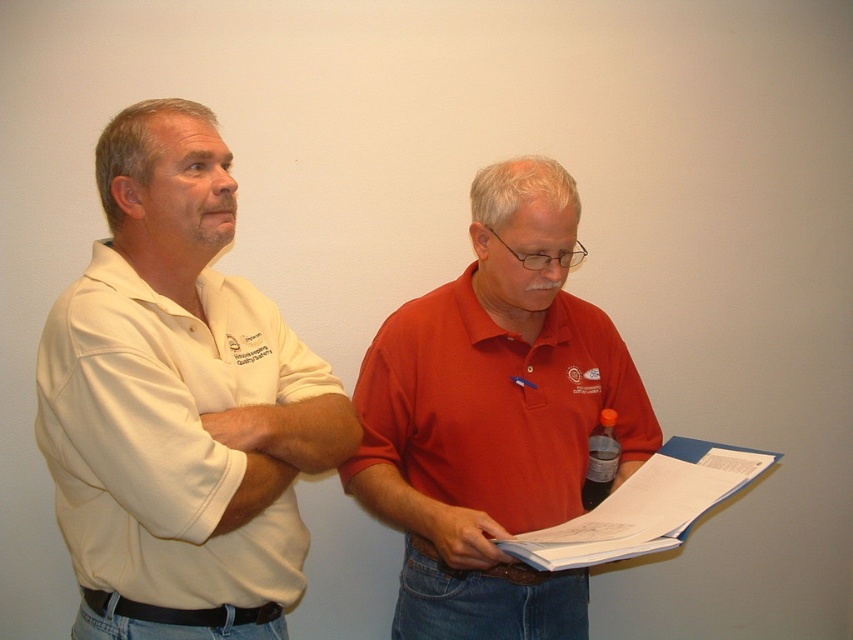
Question: Estimate the real-world distances between objects in this image. Which object is closer to the white cotton shirt at left?

Choices:
 (A) white paper at center
 (B) matte red polo shirt at center
 (C) matte red shirt at center

Answer: (C)

Question: Does white paper at center appear on the left side of matte red shirt at center?

Choices:
 (A) no
 (B) yes

Answer: (A)

Question: Does white cotton shirt at left have a smaller size compared to matte red polo shirt at center?

Choices:
 (A) no
 (B) yes

Answer: (B)

Question: Does white cotton shirt at left have a smaller size compared to matte red shirt at center?

Choices:
 (A) yes
 (B) no

Answer: (B)

Question: Which is nearer to the white cotton shirt at left?

Choices:
 (A) matte red polo shirt at center
 (B) matte red shirt at center
 (C) white paper at center

Answer: (B)

Question: Which point is closer to the camera?

Choices:
 (A) matte red shirt at center
 (B) white paper at center
 (C) matte red polo shirt at center
 (D) white cotton shirt at left

Answer: (D)